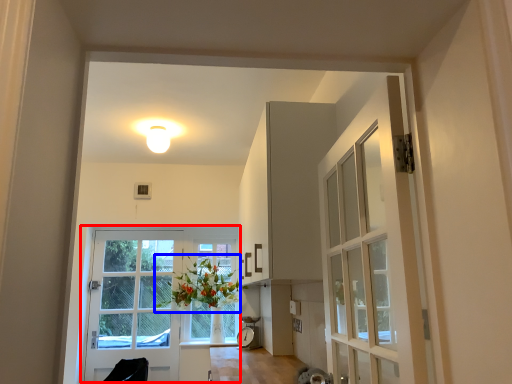
Question: Among these objects, which one is nearest to the camera, door (highlighted by a red box) or floral arrangement (highlighted by a blue box)?

Choices:
 (A) door
 (B) floral arrangement

Answer: (B)